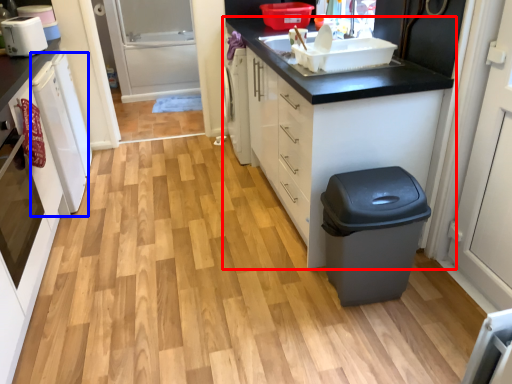
Question: Which of the following is the closest to the observer, cabinetry (highlighted by a red box) or dish washer (highlighted by a blue box)?

Choices:
 (A) cabinetry
 (B) dish washer

Answer: (A)